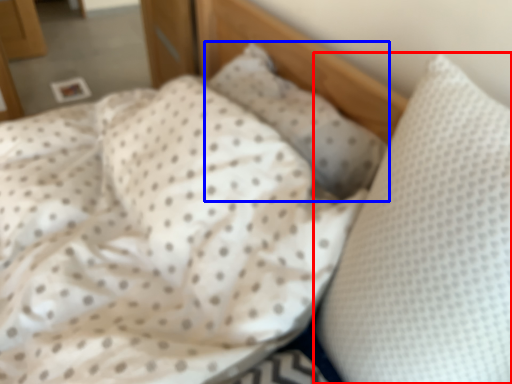
Question: Which object appears closest to the camera in this image, pillow (highlighted by a red box) or pillow (highlighted by a blue box)?

Choices:
 (A) pillow
 (B) pillow

Answer: (A)